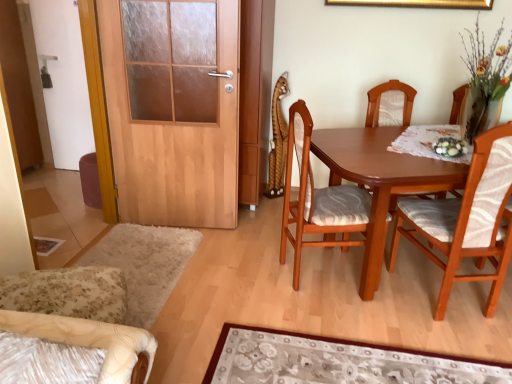
Question: In terms of size, does wooden chair with patterned cushion at center, which is the 3th chair from left to right, appear bigger or smaller than wooden chair with patterned cushion at right, arranged as the first chair when viewed from the right?

Choices:
 (A) big
 (B) small

Answer: (A)

Question: Is wooden chair with patterned cushion at center, which is counted as the second chair, starting from the right, inside the boundaries of wooden chair with patterned cushion at right, which appears as the 4th chair when viewed from the left, or outside?

Choices:
 (A) outside
 (B) inside

Answer: (A)

Question: Which object is positioned closest to the wooden door at left?

Choices:
 (A) wooden chair with patterned cushion at right, which appears as the 4th chair when viewed from the left
 (B) floral carpet at lower center
 (C) gold metallic picture frame at upper center
 (D) wooden chair with patterned cushion at center, which is counted as the second chair, starting from the right
 (E) floral fabric armchair at lower left, the first chair from the left

Answer: (D)

Question: Considering the real-world distances, which object is farthest from the white glossy door at left?

Choices:
 (A) gold metallic picture frame at upper center
 (B) wooden door at left
 (C) floral fabric armchair at lower left, the first chair from the left
 (D) wooden chair with patterned cushion at right, arranged as the first chair when viewed from the right
 (E) wooden chair with patterned cushion at center, positioned as the third chair in right-to-left order

Answer: (D)